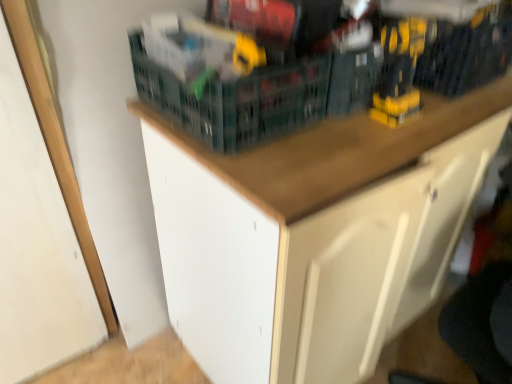
Where is `free space to the right of yellow plastic drill at upper right, the 1th toy viewed from the right`? free space to the right of yellow plastic drill at upper right, the 1th toy viewed from the right is located at coordinates (465, 112).